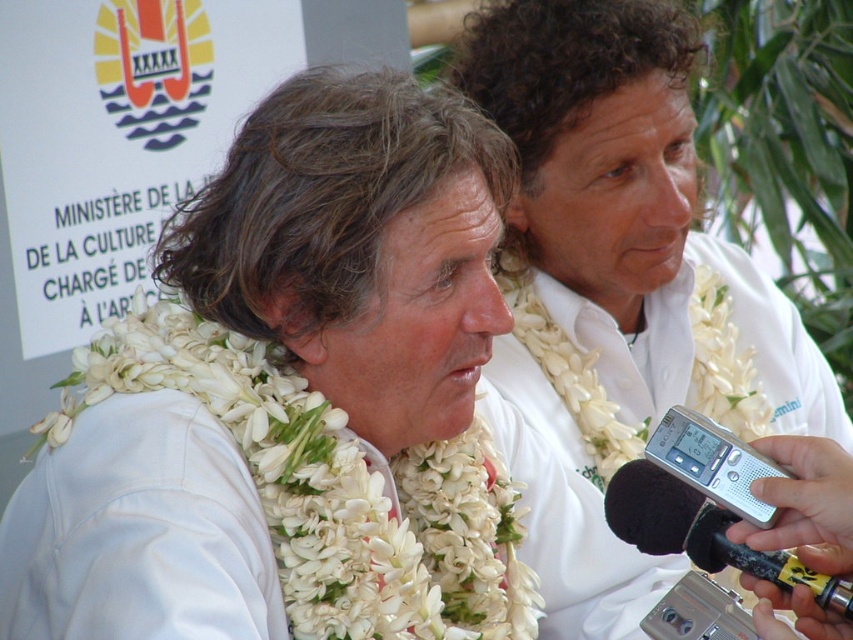
Question: Considering the real-world distances, which object is farthest from the white fabric lei at center?

Choices:
 (A) silver metallic video camera at lower center
 (B) white fabric shirt at upper center
 (C) black foam microphone at lower right

Answer: (B)

Question: Which of the following is the farthest from the observer?

Choices:
 (A) (746, 621)
 (B) (357, 609)
 (C) (636, 541)

Answer: (A)

Question: Observing the image, what is the correct spatial positioning of black foam microphone at lower right in reference to silver metallic video camera at lower center?

Choices:
 (A) left
 (B) right

Answer: (A)

Question: Is white fabric lei at center positioned in front of white fabric shirt at upper center?

Choices:
 (A) yes
 (B) no

Answer: (A)

Question: Which point is farther to the camera?

Choices:
 (A) (670, 621)
 (B) (717, 548)
 (C) (408, 381)

Answer: (C)

Question: Where is white fabric lei at center located in relation to black foam microphone at lower right in the image?

Choices:
 (A) below
 (B) above

Answer: (B)